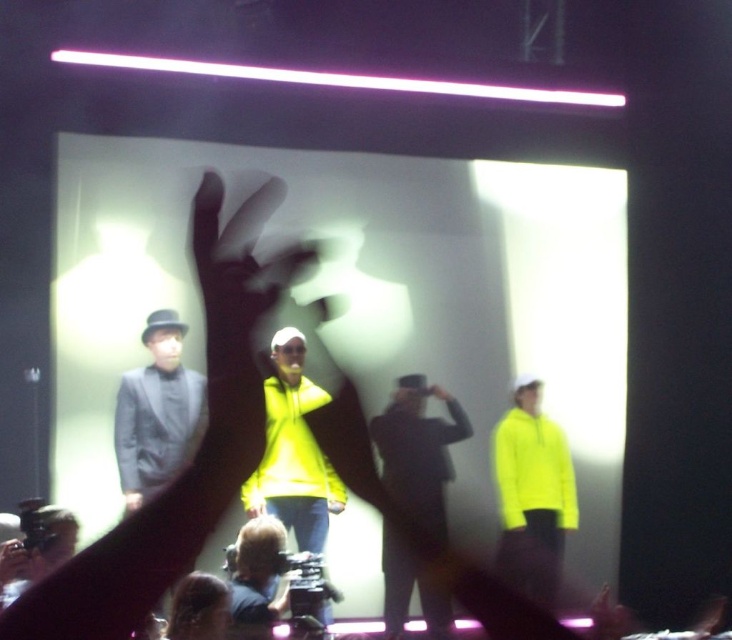
Question: Can you confirm if dark gray suit at center is positioned above neon yellow hoodie at right?

Choices:
 (A) yes
 (B) no

Answer: (A)

Question: Which object is positioned closest to the dark gray suit at center?

Choices:
 (A) neon yellow hoodie at right
 (B) neon yellow hoodie at center

Answer: (A)

Question: Can you confirm if dark gray suit at center is positioned to the right of neon yellow hoodie at right?

Choices:
 (A) no
 (B) yes

Answer: (A)

Question: Considering the relative positions of dark gray suit at center and neon yellow hoodie at right in the image provided, where is dark gray suit at center located with respect to neon yellow hoodie at right?

Choices:
 (A) above
 (B) below

Answer: (A)

Question: Estimate the real-world distances between objects in this image. Which object is closer to the neon yellow hoodie at right?

Choices:
 (A) dark gray suit at center
 (B) neon yellow hoodie at center

Answer: (A)

Question: Among these objects, which one is nearest to the camera?

Choices:
 (A) dark gray suit at center
 (B) neon yellow hoodie at right

Answer: (A)